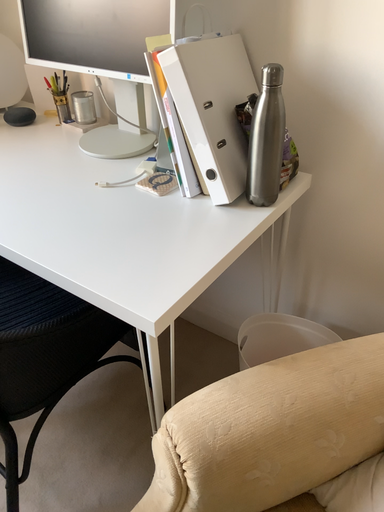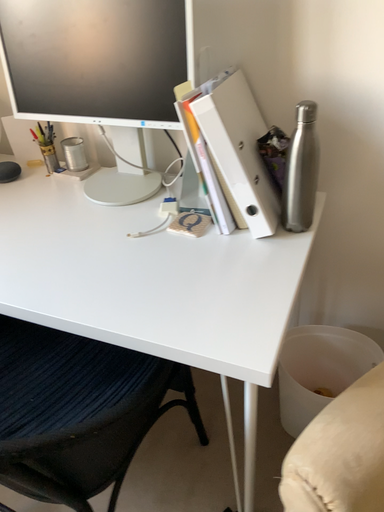
Question: Which way did the camera rotate in the video?

Choices:
 (A) rotated left
 (B) rotated right

Answer: (B)